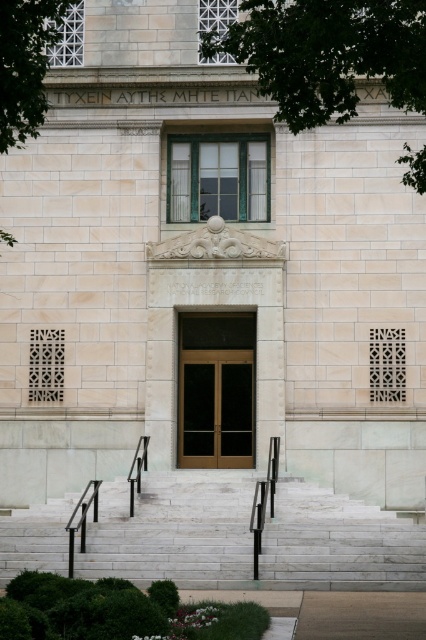
You are standing at the bottom of the white marble stairs at lower center and want to look up at the green leafy tree at upper center. Can you see the tree from your current position?

Yes, because the white marble stairs at lower center is positioned under the green leafy tree at upper center, so the tree should be visible from the stairs.

You are standing in front of the building and want to locate two specific points on its facade. The first point is at coordinates point (368, 515) and the second is at point (32, 20). Which of these points is closer to you?

Point (368, 515) is further to the viewer than point (32, 20), so the point closer to you is point (32, 20).